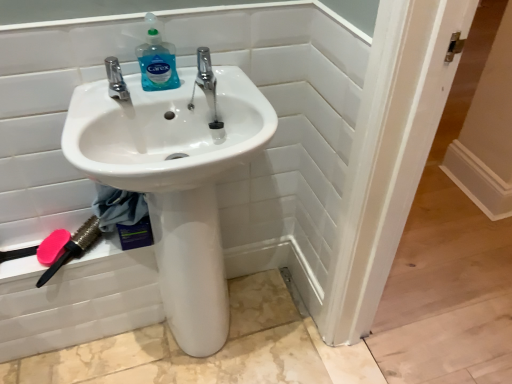
Image resolution: width=512 pixels, height=384 pixels. I want to click on vacant area to the right of translucent plastic bottle at upper center, so point(207,78).